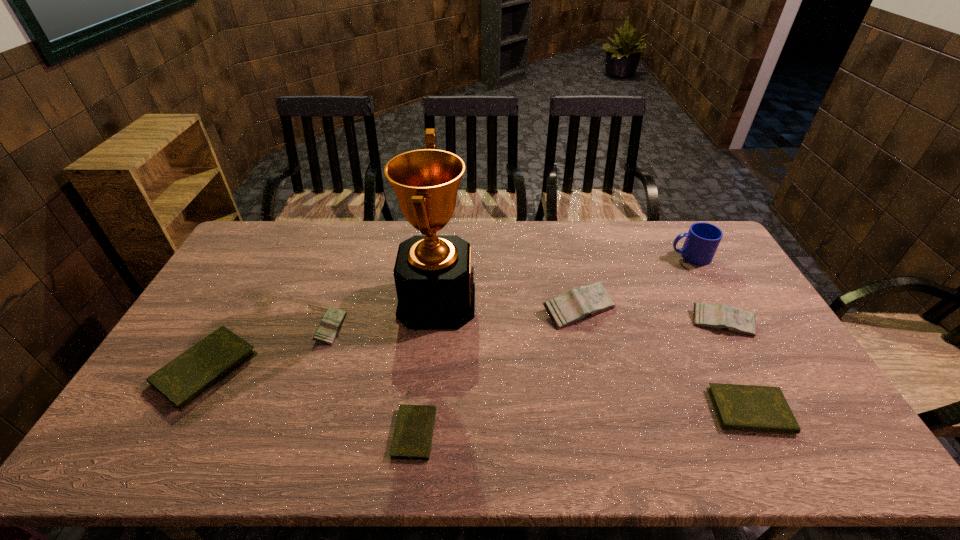
Identify the location of vacant space located on the right of the biggest pink diary. (680, 309).

You are a GUI agent. You are given a task and a screenshot of the screen. Output one action in this format:
    pyautogui.click(x=<x>, y=<y>)
    Task: Click on the vacant space located 0.180m on the front of the fifth shortest diary
    This screenshot has width=960, height=540.
    Given the screenshot: What is the action you would take?
    pyautogui.click(x=759, y=389)

At what (x,y) coordinates should I click in order to perform the action: click on vacant space located 0.080m on the right of the fifth diary from right to left. Please return your answer as a coordinate pair (x, y). The image size is (960, 540). Looking at the image, I should click on (370, 328).

Identify the location of vacant point located on the back of the biggest green diary. The height and width of the screenshot is (540, 960). (249, 292).

The height and width of the screenshot is (540, 960). Identify the location of vacant space located on the left of the second shortest diary. point(580,411).

This screenshot has width=960, height=540. In order to click on vacant space located 0.260m on the left of the shortest diary in this screenshot , I will do `click(288, 433)`.

Identify the location of object situated at the far edge. (702, 240).

Where is `object that is at the left edge`? Image resolution: width=960 pixels, height=540 pixels. object that is at the left edge is located at coordinates [185, 379].

The height and width of the screenshot is (540, 960). Find the location of `mug situated at the right edge`. mug situated at the right edge is located at coordinates [702, 240].

Where is `object present at the far right corner`? The image size is (960, 540). object present at the far right corner is located at coordinates (702, 240).